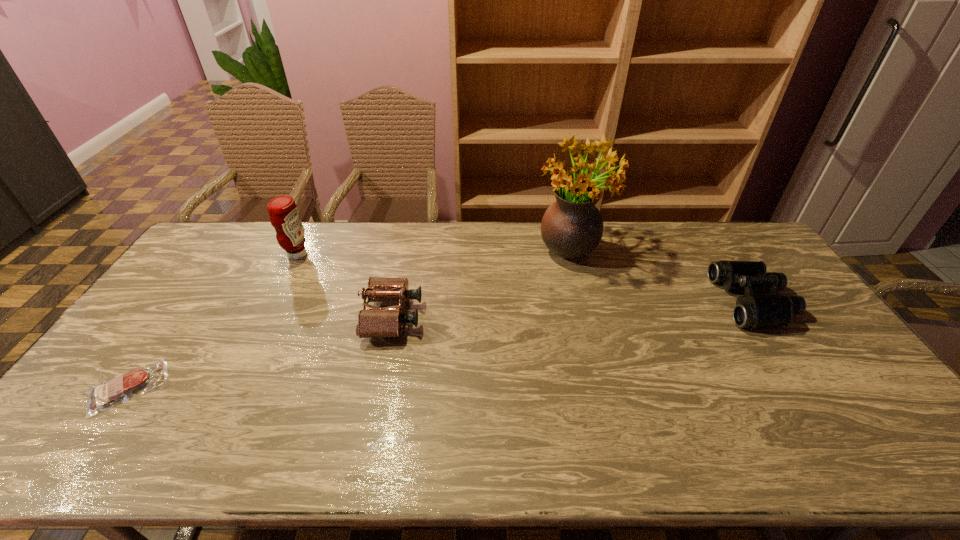
Locate an element on the screen. Image resolution: width=960 pixels, height=540 pixels. vacant area situated 0.110m through the eyepieces of the left binoculars is located at coordinates (457, 316).

You are a GUI agent. You are given a task and a screenshot of the screen. Output one action in this format:
    pyautogui.click(x=<x>, y=<y>)
    Task: Click on the free space located 0.160m on the front-facing side of the rightmost object
    The height and width of the screenshot is (540, 960).
    Given the screenshot: What is the action you would take?
    pyautogui.click(x=669, y=301)

This screenshot has width=960, height=540. Identify the location of vacant space located 0.250m on the front-facing side of the rightmost object. (640, 301).

You are a GUI agent. You are given a task and a screenshot of the screen. Output one action in this format:
    pyautogui.click(x=<x>, y=<y>)
    Task: Click on the vacant space located 0.250m on the front-facing side of the rightmost object
    The image size is (960, 540).
    Given the screenshot: What is the action you would take?
    pyautogui.click(x=640, y=301)

Where is `vacant position located 0.320m on the right of the leftmost object`? The width and height of the screenshot is (960, 540). vacant position located 0.320m on the right of the leftmost object is located at coordinates (294, 387).

I want to click on flower arrangement that is positioned at the far edge, so click(x=572, y=227).

What are the coordinates of `condiment situated at the far edge` in the screenshot? It's located at (284, 216).

Image resolution: width=960 pixels, height=540 pixels. In order to click on object positioned at the left edge in this screenshot , I will do `click(102, 396)`.

Locate an element on the screen. This screenshot has height=540, width=960. object that is positioned at the right edge is located at coordinates (x=752, y=311).

The height and width of the screenshot is (540, 960). In the image, there is a desktop. Identify the location of vacant space at the far edge. (321, 233).